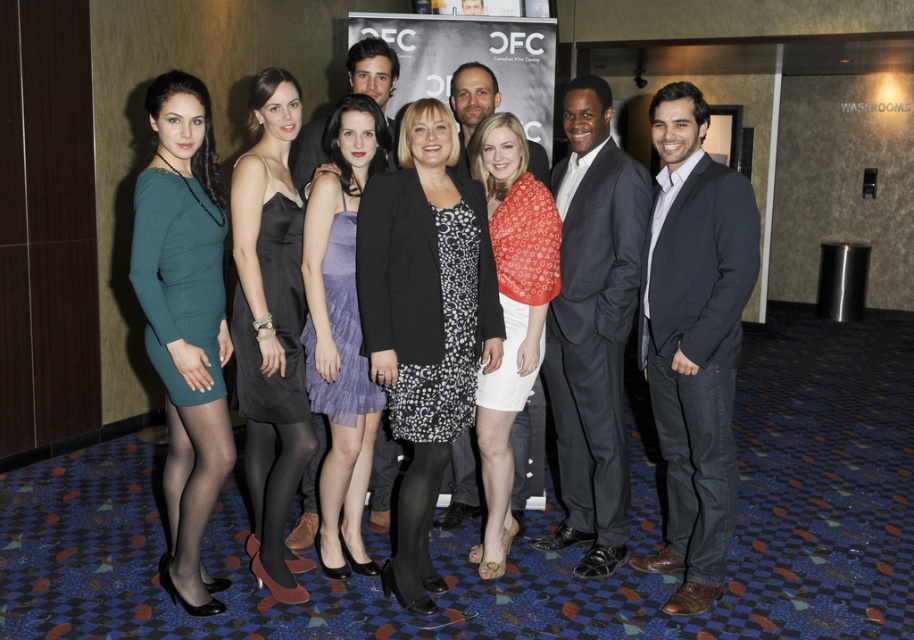
You are a photographer at the Ontario Film Centre event. You need to capture a photo where the dark gray suit at center and the satin black dress at center are both visible. Based on their positions, which one will appear lower in the photo?

The dark gray suit at center is located below the satin black dress at center, so in the photo, the dark gray suit at center will appear lower than the satin black dress at center.

In the image of the group photo at the Ontario Film Centre, there is a dark gray suit at center and a satin black dress at center. Which one is positioned more to the right side?

The dark gray suit at center is positioned to the right of the satin black dress at center, so the dark gray suit at center is more to the right.

You are a photographer at the event and need to adjust the lighting so that the black textured blazer at center and the satin black dress at center are both visible. Since they are different distances from you, which one might require more light adjustment to ensure it doesn

The black textured blazer at center is closer to the viewer than the satin black dress at center, so it may require less light adjustment because objects closer to the camera can sometimes appear brighter or more saturated. The satin black dress at center, being further away, might need more light adjustment to ensure it stands out against the background.